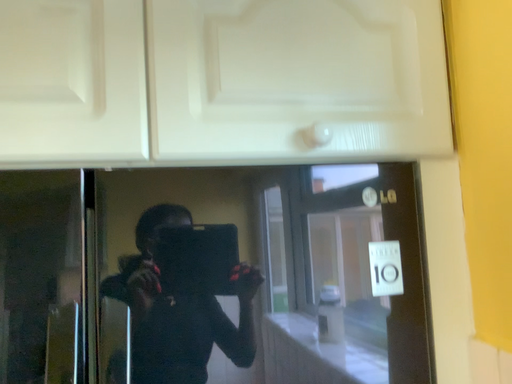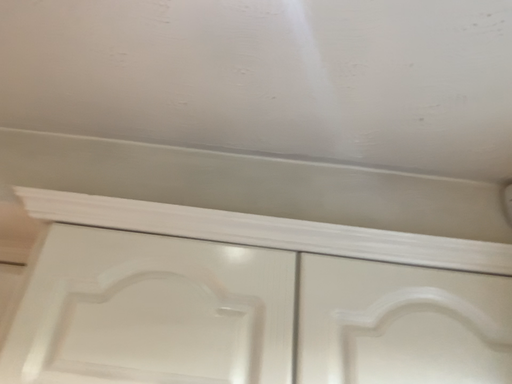
Question: Which way did the camera rotate in the video?

Choices:
 (A) rotated upward
 (B) rotated downward

Answer: (A)